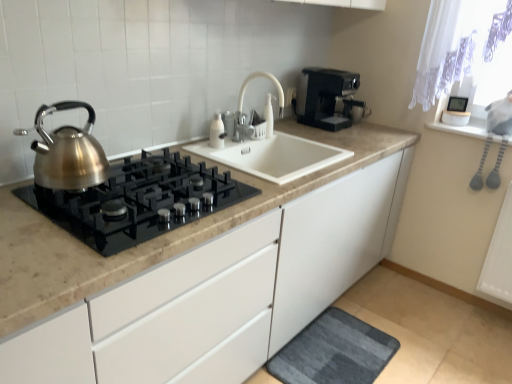
Question: Is brushed metal kettle at left in contact with black plastic coffee maker at upper right?

Choices:
 (A) no
 (B) yes

Answer: (A)

Question: Can you confirm if brushed metal kettle at left is shorter than black plastic coffee maker at upper right?

Choices:
 (A) yes
 (B) no

Answer: (A)

Question: From a real-world perspective, is brushed metal kettle at left on top of black plastic coffee maker at upper right?

Choices:
 (A) no
 (B) yes

Answer: (B)

Question: Is brushed metal kettle at left oriented towards black plastic coffee maker at upper right?

Choices:
 (A) yes
 (B) no

Answer: (B)

Question: Considering the relative positions of brushed metal kettle at left and black plastic coffee maker at upper right in the image provided, is brushed metal kettle at left to the right of black plastic coffee maker at upper right from the viewer's perspective?

Choices:
 (A) yes
 (B) no

Answer: (B)

Question: From the image's perspective, is brushed metal kettle at left on black plastic coffee maker at upper right?

Choices:
 (A) yes
 (B) no

Answer: (B)

Question: Does satin metallic gas stove at left lie behind white matte faucet at center?

Choices:
 (A) yes
 (B) no

Answer: (B)

Question: Can you confirm if satin metallic gas stove at left is bigger than white matte faucet at center?

Choices:
 (A) no
 (B) yes

Answer: (B)

Question: Is satin metallic gas stove at left facing away from white matte faucet at center?

Choices:
 (A) no
 (B) yes

Answer: (A)

Question: Can you see satin metallic gas stove at left touching white matte faucet at center?

Choices:
 (A) no
 (B) yes

Answer: (A)

Question: Would you say satin metallic gas stove at left contains white matte faucet at center?

Choices:
 (A) no
 (B) yes

Answer: (A)

Question: Is the depth of satin metallic gas stove at left less than that of white matte faucet at center?

Choices:
 (A) no
 (B) yes

Answer: (B)

Question: Does satin metallic gas stove at left lie behind black plastic coffee maker at upper right?

Choices:
 (A) yes
 (B) no

Answer: (B)